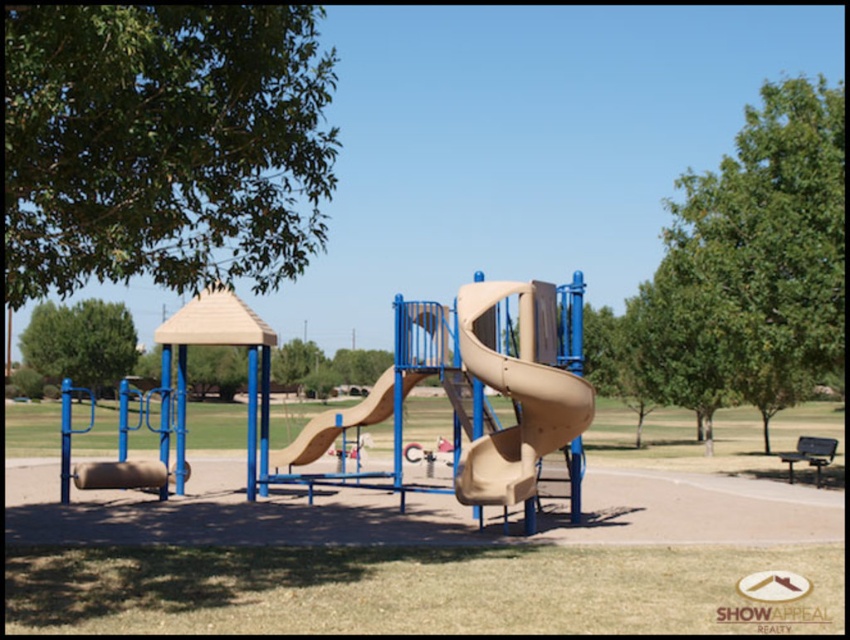
You are standing at the entrance of the playground and want to walk towards both points marked in the image. Which point, point (x=21, y=29) or point (x=72, y=344), will you reach first?

You will reach point (x=21, y=29) first because it is closer to you than point (x=72, y=344).

You are a parent watching your child play at the playground. You see the beige matte slide at center and the beige rubber slide at center. Which one is positioned higher up?

The beige matte slide at center is positioned higher up because it is above the beige rubber slide at center.

You are standing at the center of the playground and looking towards the slides. There is a point marked at coordinates (163, 145). What object does this point correspond to?

The point corresponds to the green leafy tree at upper left.